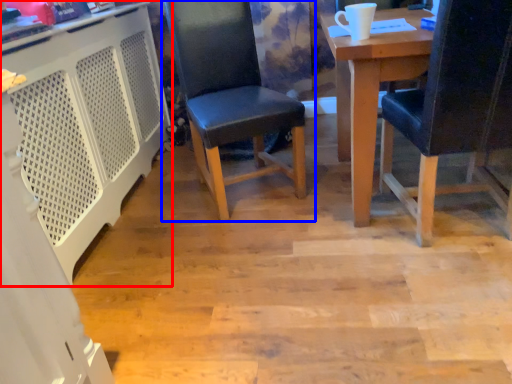
Question: Which object appears farthest to the camera in this image, computer desk (highlighted by a red box) or chair (highlighted by a blue box)?

Choices:
 (A) computer desk
 (B) chair

Answer: (B)